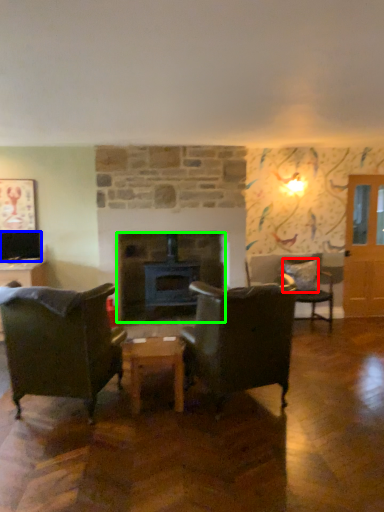
Question: Based on their relative distances, which object is nearer to pillow (highlighted by a red box)? Choose from television (highlighted by a blue box) and fireplace (highlighted by a green box).

Choices:
 (A) television
 (B) fireplace

Answer: (B)